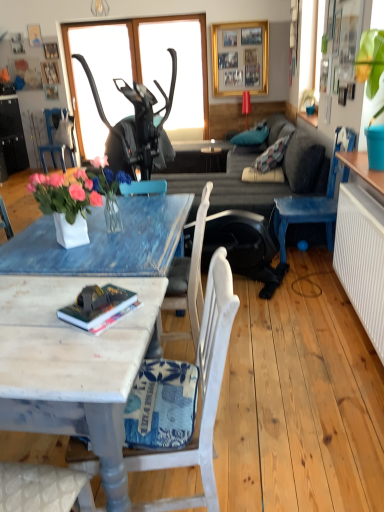
Identify the location of white ceramic vase at center. (66, 204).

What is the approximate height of wooden marble coffee table at lower left?

wooden marble coffee table at lower left is 29.78 inches tall.

Measure the distance between point (314,142) and camera.

The distance of point (314,142) from camera is 3.67 meters.

How much space does white painted wood chair at lower center, which is the third chair in back-to-front order, occupy vertically?

36.13 inches.

You are a GUI agent. You are given a task and a screenshot of the screen. Output one action in this format:
    pyautogui.click(x=<x>, y=<y>)
    Task: Click on the white ceramic vase at center
    
    Given the screenshot: What is the action you would take?
    pyautogui.click(x=66, y=204)

Is hardcover book at center inside blue painted wood chair at left, the 1th chair positioned from the left?

No, hardcover book at center is not inside blue painted wood chair at left, the 1th chair positioned from the left.

Does point (68, 127) come behind point (125, 300)?

Yes, point (68, 127) is farther from viewer.

From a real-world perspective, which is physically below, blue painted wood chair at left, acting as the 1th chair starting from the top, or hardcover book at center?

In real-world perspective, blue painted wood chair at left, acting as the 1th chair starting from the top, is lower.

Starting from the wooden marble coffee table at lower left, which chair is the 2nd one behind? Please provide its 2D coordinates.

[(310, 206)]

Is blue painted wood chair at right, which is the 2th chair from back to front, next to wooden marble coffee table at lower left and touching it?

They are not placed beside each other.

From a real-world perspective, does hardcover book at center sit lower than wooden marble coffee table at lower left?

Actually, hardcover book at center is physically above wooden marble coffee table at lower left in the real world.

Considering the sizes of hardcover book at center and wooden marble coffee table at lower left in the image, is hardcover book at center taller or shorter than wooden marble coffee table at lower left?

hardcover book at center is shorter than wooden marble coffee table at lower left.

Is hardcover book at center to the left or to the right of wooden marble coffee table at lower left in the image?

In the image, hardcover book at center appears on the right side of wooden marble coffee table at lower left.

From the image's perspective, is hardcover book at center located above or below wooden marble coffee table at lower left?

Based on their image positions, hardcover book at center is located above wooden marble coffee table at lower left.

From a real-world perspective, relative to blue painted wood chair at left, the third chair when ordered from bottom to top, is blue painted wood chair at right, positioned as the second chair in front-to-back order, vertically above or below?

In terms of real-world spatial position, blue painted wood chair at right, positioned as the second chair in front-to-back order, is above blue painted wood chair at left, the third chair when ordered from bottom to top.

From the image's perspective, is blue painted wood chair at right, which is the 2th chair from back to front, above or below blue painted wood chair at left, the third chair viewed from the front?

blue painted wood chair at right, which is the 2th chair from back to front, is below blue painted wood chair at left, the third chair viewed from the front.

Is point (332, 218) positioned after point (51, 147)?

No, it is in front of (51, 147).

Would you consider transparent glass window at upper center to be distant from white ceramic vase at center?

Yes, transparent glass window at upper center and white ceramic vase at center are quite far apart.

Between transparent glass window at upper center and white ceramic vase at center, which one has larger size?

transparent glass window at upper center.

Is transparent glass window at upper center to the left or to the right of white ceramic vase at center in the image?

From the image, it's evident that transparent glass window at upper center is to the left of white ceramic vase at center.

Considering the relative sizes of transparent glass window at upper center and white ceramic vase at center in the image provided, is transparent glass window at upper center thinner than white ceramic vase at center?

Correct, the width of transparent glass window at upper center is less than that of white ceramic vase at center.

Which point is more forward, [255,63] or [64,170]?

The point [64,170] is more forward.

From a real-world perspective, is gold metallic picture frame at upper center on blue painted wood chair at left, the third chair viewed from the front?

Indeed, from a real-world perspective, gold metallic picture frame at upper center stands above blue painted wood chair at left, the third chair viewed from the front.

Starting from the gold metallic picture frame at upper center, which chair is the 2nd one to the left? Please provide its 2D coordinates.

[(58, 137)]

Considering the points (111, 138) and (259, 74), which point is behind, point (111, 138) or point (259, 74)?

The point (259, 74) is farther from the camera.

Considering the relative sizes of dark gray fabric couch at center and gold metallic picture frame at upper center in the image provided, is dark gray fabric couch at center shorter than gold metallic picture frame at upper center?

Yes, dark gray fabric couch at center is shorter than gold metallic picture frame at upper center.

Are dark gray fabric couch at center and gold metallic picture frame at upper center making contact?

No, dark gray fabric couch at center is not in contact with gold metallic picture frame at upper center.

From the image's perspective, is dark gray fabric couch at center positioned above or below gold metallic picture frame at upper center?

Based on their image positions, dark gray fabric couch at center is located beneath gold metallic picture frame at upper center.

Identify the location of chair that is the 2nd object located behind the hardcover book at center. The width and height of the screenshot is (384, 512). (58, 137).

Where is `coffee table in front of the blue painted wood chair at right, arranged as the 1th chair when viewed from the right`? coffee table in front of the blue painted wood chair at right, arranged as the 1th chair when viewed from the right is located at coordinates (72, 367).

Which object lies further to the anchor point wooden marble coffee table at lower left, white painted wood chair at lower center, which is the third chair in back-to-front order, or dark gray fabric couch at center?

The object further to wooden marble coffee table at lower left is dark gray fabric couch at center.

Based on their spatial positions, is white ceramic vase at center or transparent glass window at upper center further from blue painted wood chair at left, the third chair when ordered from bottom to top?

white ceramic vase at center lies further to blue painted wood chair at left, the third chair when ordered from bottom to top, than the other object.

Looking at the image, which one is located closer to blue painted wood chair at left, the 1th chair in the back-to-front sequence, hardcover book at center or wooden marble coffee table at lower left?

wooden marble coffee table at lower left is closer to blue painted wood chair at left, the 1th chair in the back-to-front sequence.

Looking at this image, considering their positions, is dark gray fabric couch at center positioned closer to blue painted wood chair at right, positioned as the second chair in front-to-back order, than blue painted wood chair at left, the 1th chair positioned from the left?

dark gray fabric couch at center lies closer to blue painted wood chair at right, positioned as the second chair in front-to-back order, than the other object.

When comparing their distances from dark gray fabric couch at center, does transparent glass window at upper center or white ceramic vase at center seem closer?

Based on the image, transparent glass window at upper center appears to be nearer to dark gray fabric couch at center.

Looking at the image, which one is located closer to blue painted wood chair at right, the third chair in the left-to-right sequence, white ceramic vase at center or wooden marble coffee table at lower left?

white ceramic vase at center is positioned closer to the anchor blue painted wood chair at right, the third chair in the left-to-right sequence.

Considering their positions, is matte black side table at center positioned further to wooden marble coffee table at lower left than gold metallic picture frame at upper center?

gold metallic picture frame at upper center.

From the picture: Looking at the image, which one is located further to matte black side table at center, dark gray fabric couch at center or gold metallic picture frame at upper center?

gold metallic picture frame at upper center lies further to matte black side table at center than the other object.

The width and height of the screenshot is (384, 512). In order to click on side table between white painted wood chair at lower center, the 2th chair viewed from the left, and transparent glass window at upper center in the front-back direction in this screenshot , I will do `click(212, 157)`.

This screenshot has height=512, width=384. I want to click on side table positioned between dark gray fabric couch at center and gold metallic picture frame at upper center from near to far, so click(x=212, y=157).

Where is `houseplant between wooden marble coffee table at lower left and transparent glass window at upper center along the z-axis`? This screenshot has width=384, height=512. houseplant between wooden marble coffee table at lower left and transparent glass window at upper center along the z-axis is located at coordinates (66, 204).

Identify the location of houseplant located between white painted wood chair at lower center, the 2th chair viewed from the left, and blue painted wood chair at left, the third chair viewed from the front, in the depth direction. (x=66, y=204).